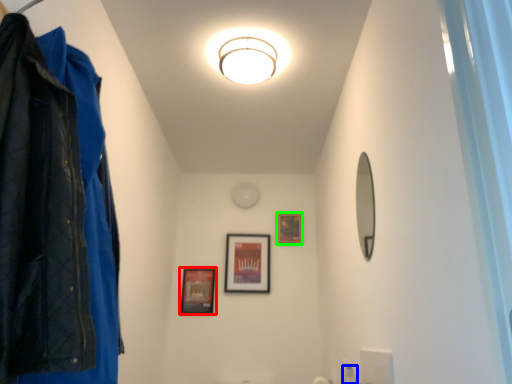
Question: Which object is the farthest from picture frame (highlighted by a red box)? Choose among these: toiletry (highlighted by a blue box) or picture frame (highlighted by a green box).

Choices:
 (A) toiletry
 (B) picture frame

Answer: (A)